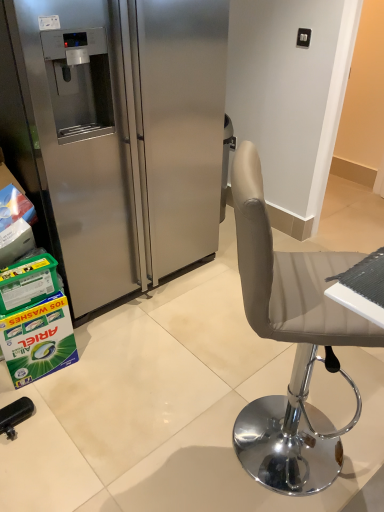
Question: Can green cardboard box at lower left, the first box when ordered from bottom to top, be found inside stainless steel refrigerator at left?

Choices:
 (A) yes
 (B) no

Answer: (B)

Question: Can you confirm if stainless steel refrigerator at left is positioned to the right of green cardboard box at lower left, which ranks as the second box in top-to-bottom order?

Choices:
 (A) yes
 (B) no

Answer: (A)

Question: Is stainless steel refrigerator at left bigger than green cardboard box at lower left, which ranks as the second box in top-to-bottom order?

Choices:
 (A) no
 (B) yes

Answer: (B)

Question: Considering the relative positions of stainless steel refrigerator at left and green cardboard box at lower left, the first box when ordered from bottom to top, in the image provided, is stainless steel refrigerator at left behind green cardboard box at lower left, the first box when ordered from bottom to top,?

Choices:
 (A) no
 (B) yes

Answer: (A)

Question: Can you confirm if stainless steel refrigerator at left is wider than green cardboard box at lower left, the first box when ordered from bottom to top?

Choices:
 (A) yes
 (B) no

Answer: (A)

Question: Are stainless steel refrigerator at left and green cardboard box at lower left, the first box when ordered from bottom to top, beside each other?

Choices:
 (A) yes
 (B) no

Answer: (B)

Question: From the image's perspective, is green cardboard box at lower left, which ranks as the second box in top-to-bottom order, on top of stainless steel refrigerator at left?

Choices:
 (A) no
 (B) yes

Answer: (A)

Question: Does green cardboard box at lower left, the first box when ordered from bottom to top, have a lesser width compared to stainless steel refrigerator at left?

Choices:
 (A) yes
 (B) no

Answer: (A)

Question: Can you confirm if green cardboard box at lower left, which ranks as the second box in top-to-bottom order, is taller than stainless steel refrigerator at left?

Choices:
 (A) yes
 (B) no

Answer: (B)

Question: Considering the relative sizes of green cardboard box at lower left, which ranks as the second box in top-to-bottom order, and stainless steel refrigerator at left in the image provided, is green cardboard box at lower left, which ranks as the second box in top-to-bottom order, bigger than stainless steel refrigerator at left?

Choices:
 (A) yes
 (B) no

Answer: (B)

Question: Can you confirm if green cardboard box at lower left, the first box when ordered from bottom to top, is wider than stainless steel refrigerator at left?

Choices:
 (A) no
 (B) yes

Answer: (A)

Question: Is green cardboard box at lower left, which ranks as the second box in top-to-bottom order, aimed at stainless steel refrigerator at left?

Choices:
 (A) no
 (B) yes

Answer: (A)

Question: Is the depth of green plastic container at lower left, the second box in the bottom-to-top sequence, less than that of green cardboard box at lower left, which ranks as the second box in top-to-bottom order?

Choices:
 (A) no
 (B) yes

Answer: (B)